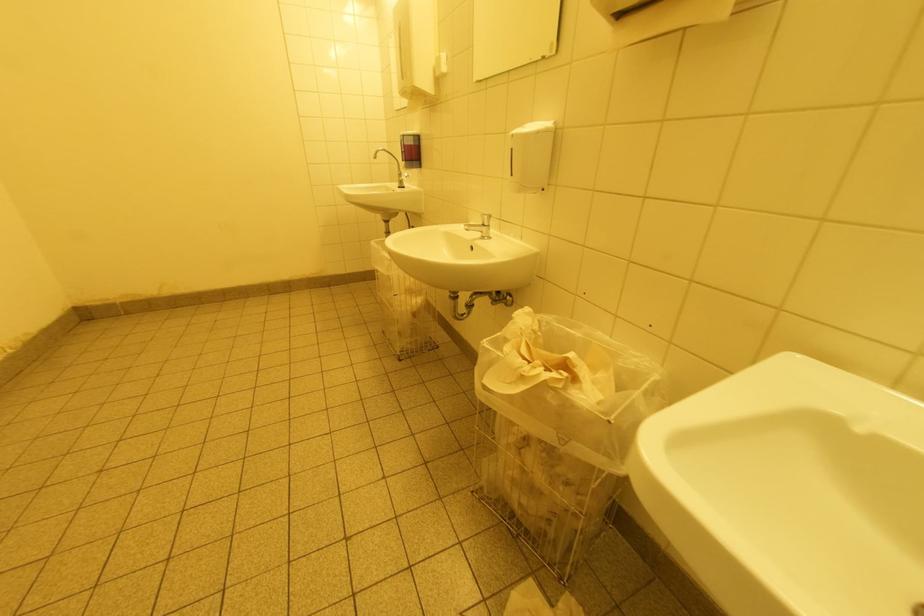
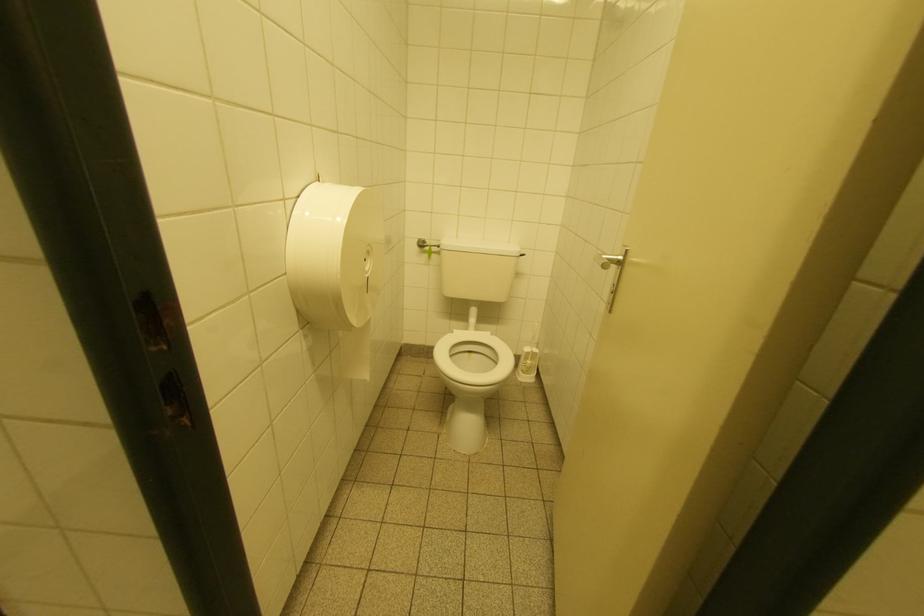
Question: Which direction would the cameraman need to move to produce the second image? Reply with the corresponding letter.

Choices:
 (A) Left
 (B) Right
 (C) Forward
 (D) Backward

Answer: (A)